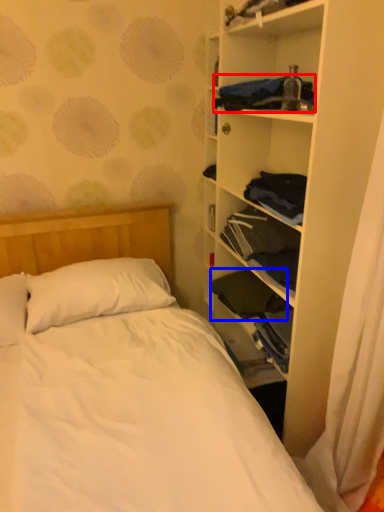
Question: Which object is further to the camera taking this photo, clothing (highlighted by a red box) or clothing (highlighted by a blue box)?

Choices:
 (A) clothing
 (B) clothing

Answer: (B)